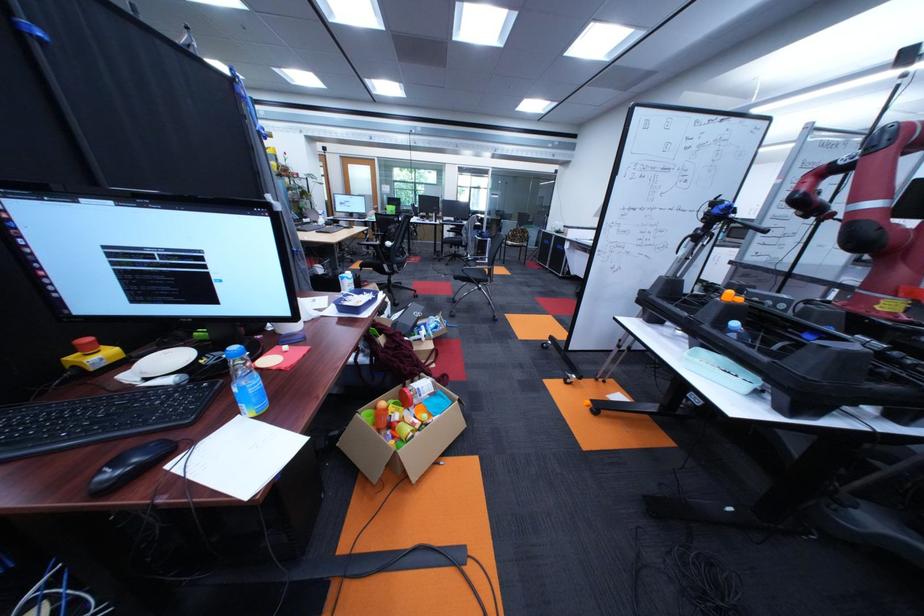
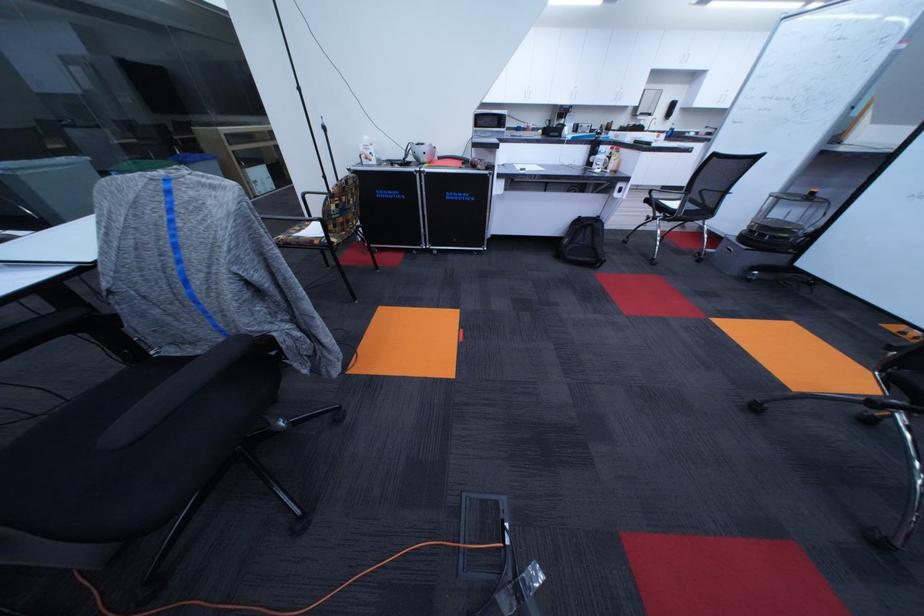
In the second image, find the point that corresponds to (x=527, y=236) in the first image.

(356, 209)